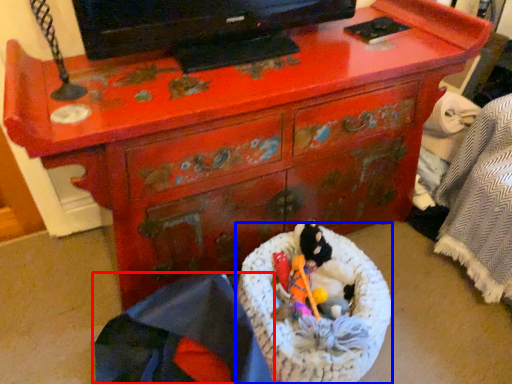
Question: Which object appears farthest to the camera in this image, material (highlighted by a red box) or laundry basket (highlighted by a blue box)?

Choices:
 (A) material
 (B) laundry basket

Answer: (B)